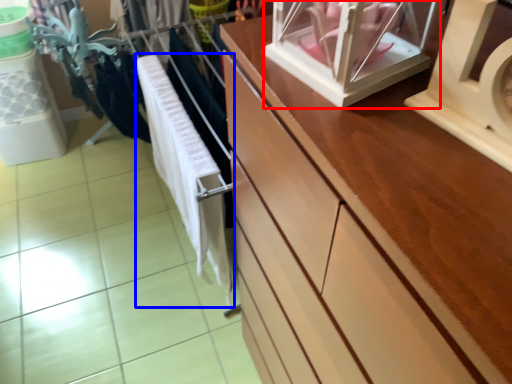
Question: Which object is closer to the camera taking this photo, glass box (highlighted by a red box) or baby clothe (highlighted by a blue box)?

Choices:
 (A) glass box
 (B) baby clothe

Answer: (A)